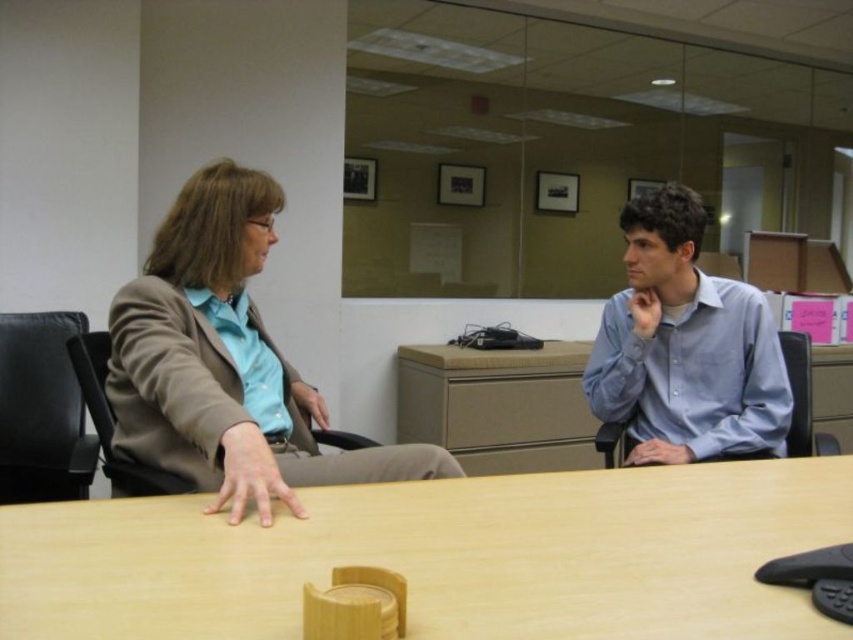
Looking at this image, you are standing in the office scene and want to place a small plant on the wooden table at center. The table is represented by the point at coordinates (444, 556). If you want to place the plant exactly at the center of the table, where should you place it?

You should place the plant at the point represented by coordinates (444, 556), which is the center of the wooden table at center.